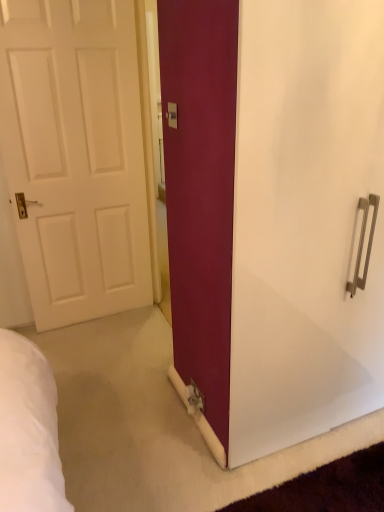
What do you see at coordinates (75, 155) in the screenshot? The image size is (384, 512). I see `white matte door at left` at bounding box center [75, 155].

Where is `white matte door at left`? white matte door at left is located at coordinates [x=75, y=155].

This screenshot has height=512, width=384. In order to click on matte white electric outlet at center in this screenshot , I will do `click(172, 115)`.

Is matte white electric outlet at center positioned with its back to white matte door at left?

matte white electric outlet at center is not turned away from white matte door at left.

Does matte white electric outlet at center come behind white matte door at left?

No, matte white electric outlet at center is in front of white matte door at left.

How distant is matte white electric outlet at center from white matte door at left?

A distance of 1.04 meters exists between matte white electric outlet at center and white matte door at left.

From the image's perspective, which is below, matte white screen door at center or white matte door at left?

matte white screen door at center.

The width and height of the screenshot is (384, 512). In order to click on screen door below the white matte door at left (from the image's perspective) in this screenshot , I will do `click(305, 222)`.

Does matte white screen door at center have a smaller size compared to white matte door at left?

Incorrect, matte white screen door at center is not smaller in size than white matte door at left.

Would you say matte white electric outlet at center contains matte white screen door at center?

No, matte white screen door at center is not surrounded by matte white electric outlet at center.

From the image's perspective, which object appears higher, matte white electric outlet at center or matte white screen door at center?

matte white electric outlet at center is shown above in the image.

The height and width of the screenshot is (512, 384). I want to click on electric outlet above the matte white screen door at center (from the image's perspective), so click(x=172, y=115).

How different are the orientations of white matte door at left and matte white screen door at center in degrees?

white matte door at left and matte white screen door at center are facing 0.659 degrees away from each other.

Considering the relative sizes of white matte door at left and matte white screen door at center in the image provided, is white matte door at left shorter than matte white screen door at center?

No.

Considering the sizes of objects white matte door at left and matte white screen door at center in the image provided, who is smaller, white matte door at left or matte white screen door at center?

With smaller size is white matte door at left.

Considering their positions, is white matte door at left located in front of or behind matte white screen door at center?

white matte door at left is behind matte white screen door at center.

From a real-world perspective, who is located higher, matte white screen door at center or matte white electric outlet at center?

matte white electric outlet at center.

Which is less distant, (x=250, y=155) or (x=176, y=108)?

The point (x=250, y=155) is more forward.

From the picture: Considering the relative positions of matte white screen door at center and matte white electric outlet at center in the image provided, is matte white screen door at center to the left of matte white electric outlet at center from the viewer's perspective?

No, matte white screen door at center is not to the left of matte white electric outlet at center.

Which of these two, white matte door at left or matte white electric outlet at center, stands shorter?

matte white electric outlet at center.

Is white matte door at left aimed at matte white electric outlet at center?

Yes, white matte door at left is aimed at matte white electric outlet at center.

From the image's perspective, which one is positioned lower, white matte door at left or matte white electric outlet at center?

From the image's view, white matte door at left is below.

At what (x,y) coordinates should I click in order to perform the action: click on electric outlet that appears on the right of white matte door at left. Please return your answer as a coordinate pair (x, y). The width and height of the screenshot is (384, 512). Looking at the image, I should click on [172, 115].

Locate an element on the screen. The width and height of the screenshot is (384, 512). door above the matte white screen door at center (from the image's perspective) is located at coordinates point(75,155).

Estimate the real-world distances between objects in this image. Which object is further from matte white screen door at center, white matte door at left or matte white electric outlet at center?

white matte door at left lies further to matte white screen door at center than the other object.

Considering their positions, is matte white screen door at center positioned further to matte white electric outlet at center than white matte door at left?

white matte door at left is further to matte white electric outlet at center.

Looking at the image, which one is located closer to white matte door at left, matte white electric outlet at center or matte white screen door at center?

The object closer to white matte door at left is matte white electric outlet at center.

When comparing their distances from matte white screen door at center, does matte white electric outlet at center or white matte door at left seem further?

white matte door at left lies further to matte white screen door at center than the other object.

Which object lies further to the anchor point white matte door at left, matte white screen door at center or matte white electric outlet at center?

matte white screen door at center is positioned further to the anchor white matte door at left.

Which object lies nearer to the anchor point matte white electric outlet at center, white matte door at left or matte white screen door at center?

Based on the image, matte white screen door at center appears to be nearer to matte white electric outlet at center.

At what (x,y) coordinates should I click in order to perform the action: click on electric outlet located between white matte door at left and matte white screen door at center in the left-right direction. Please return your answer as a coordinate pair (x, y). The image size is (384, 512). Looking at the image, I should click on (172, 115).